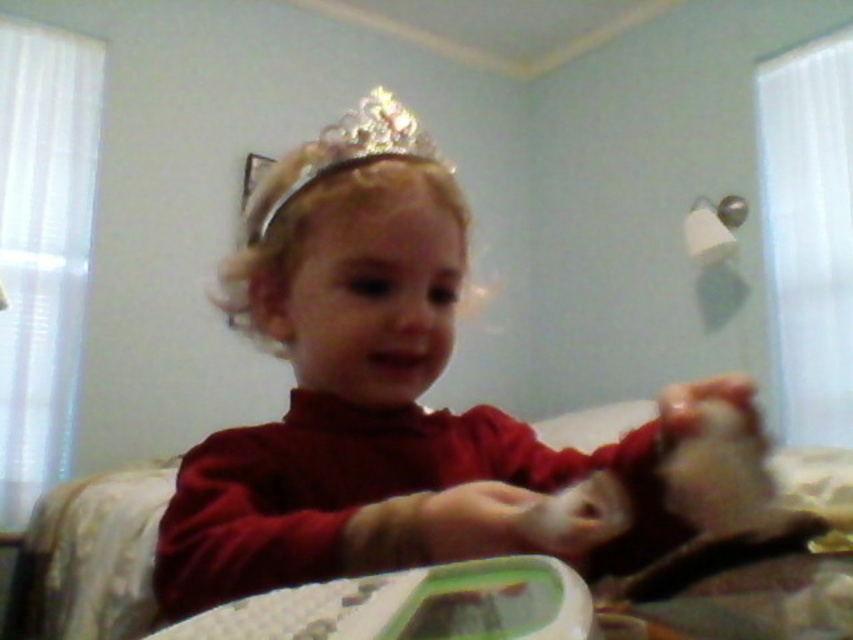
You are taking a photo of two points in a room. The first point is at coordinate point [302,285] and the second point is at coordinate point [256,225]. Which point is closer to you?

Point [302,285] is closer to the viewer than point [256,225].

You are a photographer trying to capture a clear shot of the matte red shirt at center and the sparkly gold crown at upper center in this image. Given that the camera can only focus on objects larger than 10 cm, can both items be in focus?

The matte red shirt at center is larger in size than the sparkly gold crown at upper center. Since the camera requires objects to be larger than 10 cm to focus, and the matte red shirt is bigger, it will be in focus. However, the sparkly gold crown at upper center might be too small to focus on unless it meets the size requirement. The answer depends on the actual size of the crown, but based on the description, only the larger item is guaranteed to be in focus.